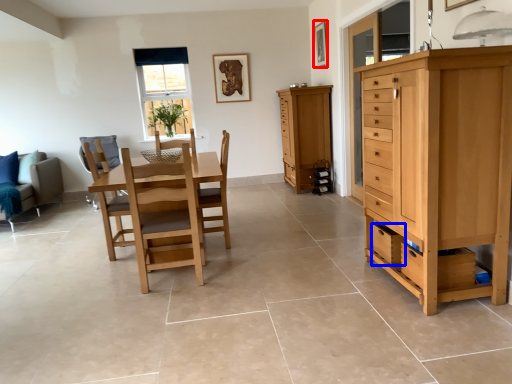
Question: Which of the following is the closest to the observer, picture frame (highlighted by a red box) or drawer (highlighted by a blue box)?

Choices:
 (A) picture frame
 (B) drawer

Answer: (B)